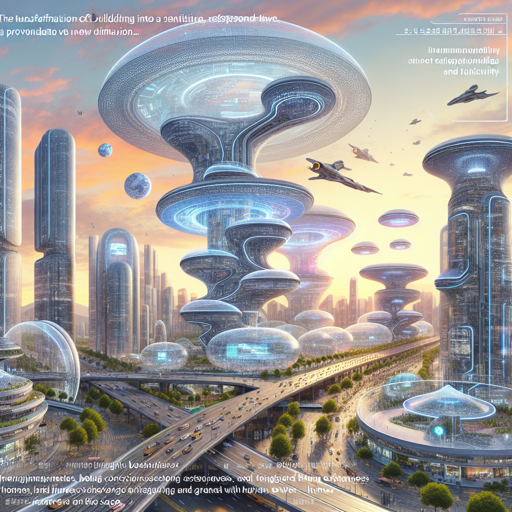
Find the location of a particular element. glass is located at coordinates (394, 419).